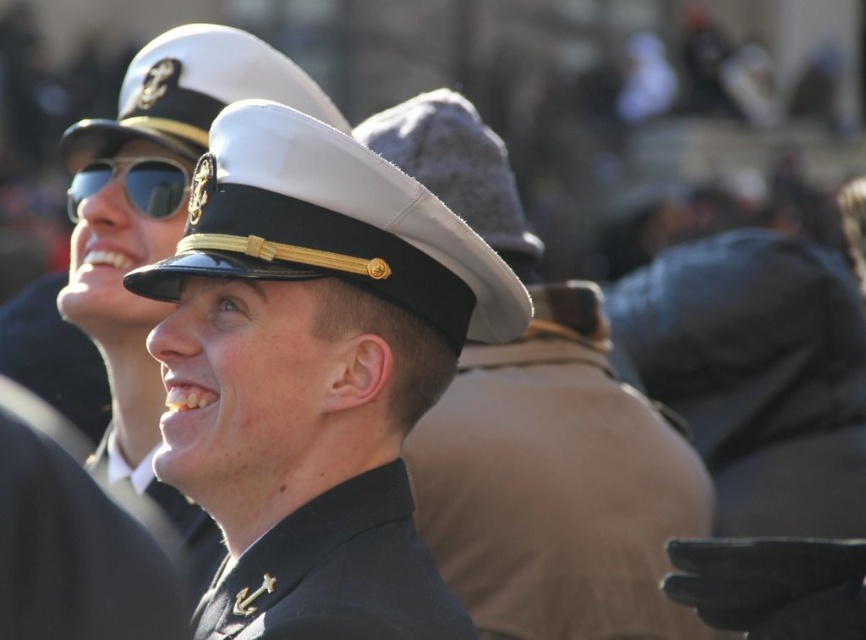
Measure the distance between glossy white hat at center and matte black goggles at upper left.

glossy white hat at center and matte black goggles at upper left are 14.09 meters apart from each other.

Is glossy white hat at center taller than matte black goggles at upper left?

Indeed, glossy white hat at center has a greater height compared to matte black goggles at upper left.

Identify the location of glossy white hat at center. (333, 227).

Can you confirm if black matte uniform at center is positioned to the right of fuzzy gray hat at center?

In fact, black matte uniform at center is to the left of fuzzy gray hat at center.

Which of these two, black matte uniform at center or fuzzy gray hat at center, stands shorter?

Standing shorter between the two is black matte uniform at center.

Does point (322, 564) come farther from viewer compared to point (467, 193)?

That is False.

You are a GUI agent. You are given a task and a screenshot of the screen. Output one action in this format:
    pyautogui.click(x=<x>, y=<y>)
    Task: Click on the black matte uniform at center
    The image size is (866, 640).
    Given the screenshot: What is the action you would take?
    pyautogui.click(x=335, y=573)

Does matte black uniform at center appear on the right side of white matte hat at upper center?

Correct, you'll find matte black uniform at center to the right of white matte hat at upper center.

Can you confirm if matte black uniform at center is positioned below white matte hat at upper center?

Yes, matte black uniform at center is below white matte hat at upper center.

In the scene shown: Measure the distance between point (457, 550) and camera.

Point (457, 550) and camera are 77.30 meters apart from each other.

Identify the location of matte black uniform at center. Image resolution: width=866 pixels, height=640 pixels. (540, 429).